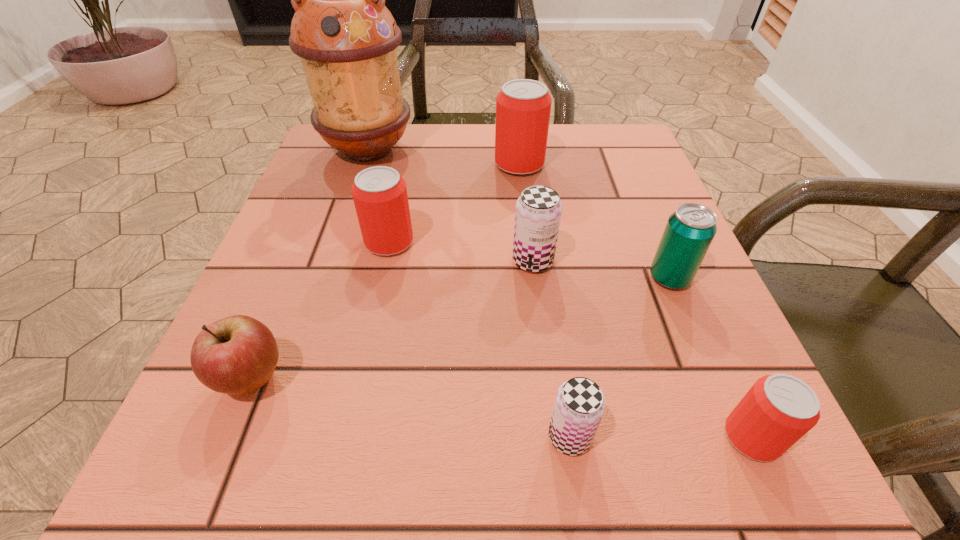
The height and width of the screenshot is (540, 960). In order to click on oil lamp located in the far edge section of the desktop in this screenshot , I will do `click(346, 38)`.

You are a GUI agent. You are given a task and a screenshot of the screen. Output one action in this format:
    pyautogui.click(x=<x>, y=<y>)
    Task: Click on the beer can positioned at the far edge
    
    Given the screenshot: What is the action you would take?
    pyautogui.click(x=523, y=106)

Locate an element on the screen. Image resolution: width=960 pixels, height=540 pixels. oil lamp at the left edge is located at coordinates (346, 38).

Where is `beer can present at the left edge`? beer can present at the left edge is located at coordinates (379, 193).

At what (x,y) coordinates should I click in order to perform the action: click on apple positioned at the left edge. Please return your answer as a coordinate pair (x, y). This screenshot has height=540, width=960. Looking at the image, I should click on pyautogui.click(x=238, y=354).

This screenshot has width=960, height=540. In order to click on object located at the far left corner in this screenshot , I will do `click(346, 38)`.

Locate an element on the screen. This screenshot has width=960, height=540. object located in the near right corner section of the desktop is located at coordinates (779, 409).

In the image, there is a desktop. Where is `blank space at the far edge`? The height and width of the screenshot is (540, 960). blank space at the far edge is located at coordinates (400, 141).

Locate an element on the screen. This screenshot has height=540, width=960. vacant space at the near edge of the desktop is located at coordinates (314, 505).

Find the location of a particular element. free space at the left edge of the desktop is located at coordinates (231, 421).